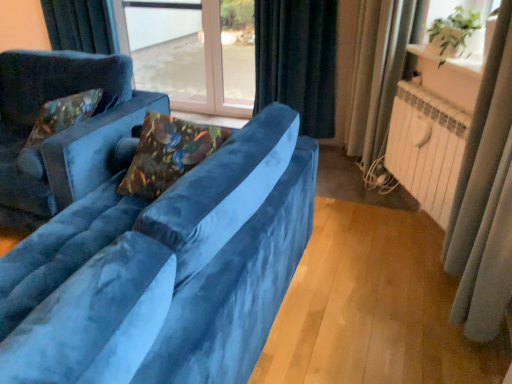
Question: From the image's perspective, is velvet floral pillow at center, which is the first pillow in right-to-left order, located above or below velvet blue couch at left, the second studio couch positioned from the right?

Choices:
 (A) below
 (B) above

Answer: (A)

Question: In the image, is velvet floral pillow at center, placed as the first pillow when sorted from front to back, on the left side or the right side of velvet blue couch at left, arranged as the 1th studio couch when viewed from the left?

Choices:
 (A) right
 (B) left

Answer: (A)

Question: Which object is positioned farthest from the velvet floral pillow at left, the first pillow in the left-to-right sequence?

Choices:
 (A) velvet floral pillow at center, which is the first pillow in right-to-left order
 (B) white painted metal radiator at right
 (C) black velvet curtain at upper center, the third curtain viewed from the front
 (D) silky gray curtain at right, acting as the first curtain starting from the front
 (E) velvet blue couch at left, arranged as the 1th studio couch when viewed from the right

Answer: (D)

Question: Which object is positioned closest to the velvet floral pillow at center, the 2th pillow in the back-to-front sequence?

Choices:
 (A) velvet blue couch at left, arranged as the 1th studio couch when viewed from the left
 (B) white glossy window sill at upper right
 (C) velvet floral pillow at left, the first pillow in the left-to-right sequence
 (D) green leafy plant at upper right, acting as the second window screen starting from the left
 (E) transparent glass window screen at center, which ranks as the 2th window screen in front-to-back order

Answer: (C)